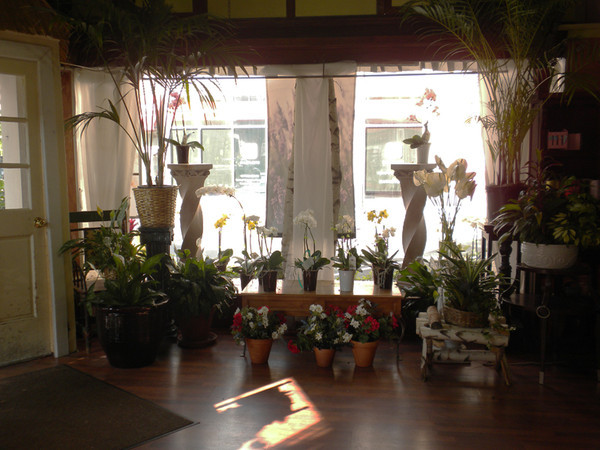
Locate an element on the screen. palm plant is located at coordinates (150, 166).